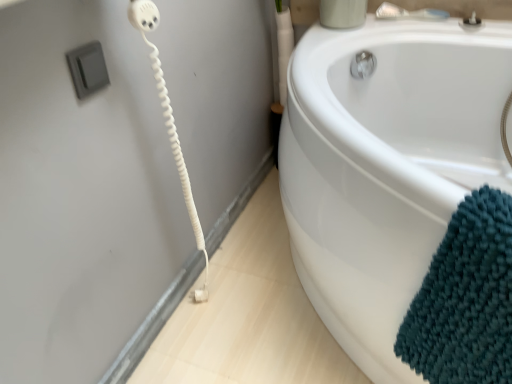
Where is `teal chenille bath towel at lower right`? The height and width of the screenshot is (384, 512). teal chenille bath towel at lower right is located at coordinates (465, 299).

Measure the distance between teal chenille bath towel at lower right and camera.

teal chenille bath towel at lower right and camera are 56.20 centimeters apart from each other.

Describe the element at coordinates (465, 299) in the screenshot. I see `teal chenille bath towel at lower right` at that location.

What do you see at coordinates (409, 13) in the screenshot?
I see `silver metallic faucet at upper right` at bounding box center [409, 13].

Image resolution: width=512 pixels, height=384 pixels. Identify the location of silver metallic faucet at upper right. (409, 13).

Locate an element on the screen. teal chenille bath towel at lower right is located at coordinates (465, 299).

Can you confirm if teal chenille bath towel at lower right is positioned to the left of silver metallic faucet at upper right?

Yes, teal chenille bath towel at lower right is to the left of silver metallic faucet at upper right.

Relative to silver metallic faucet at upper right, is teal chenille bath towel at lower right in front or behind?

In the image, teal chenille bath towel at lower right appears in front of silver metallic faucet at upper right.

Considering the positions of point (434, 361) and point (435, 9), is point (434, 361) closer or farther from the camera than point (435, 9)?

Point (434, 361) appears to be closer to the viewer than point (435, 9).

From the image's perspective, between teal chenille bath towel at lower right and silver metallic faucet at upper right, which one is located above?

From the image's view, silver metallic faucet at upper right is above.

From a real-world perspective, is teal chenille bath towel at lower right positioned under silver metallic faucet at upper right based on gravity?

Yes, from a real-world perspective, teal chenille bath towel at lower right is under silver metallic faucet at upper right.

Does teal chenille bath towel at lower right have a greater width compared to silver metallic faucet at upper right?

Yes.

Between teal chenille bath towel at lower right and silver metallic faucet at upper right, which one has less height?

silver metallic faucet at upper right.

Considering the sizes of teal chenille bath towel at lower right and silver metallic faucet at upper right in the image, is teal chenille bath towel at lower right bigger or smaller than silver metallic faucet at upper right?

In the image, teal chenille bath towel at lower right appears to be larger than silver metallic faucet at upper right.

Is teal chenille bath towel at lower right not inside silver metallic faucet at upper right?

teal chenille bath towel at lower right lies outside silver metallic faucet at upper right's area.

Are teal chenille bath towel at lower right and silver metallic faucet at upper right making contact?

teal chenille bath towel at lower right is not next to silver metallic faucet at upper right, and they're not touching.

Is teal chenille bath towel at lower right facing towards silver metallic faucet at upper right?

No, teal chenille bath towel at lower right is not facing towards silver metallic faucet at upper right.

How many degrees apart are the facing directions of teal chenille bath towel at lower right and silver metallic faucet at upper right?

teal chenille bath towel at lower right and silver metallic faucet at upper right are facing 25.6 degrees away from each other.

Measure the distance between teal chenille bath towel at lower right and silver metallic faucet at upper right.

teal chenille bath towel at lower right is 97.88 centimeters from silver metallic faucet at upper right.

Image resolution: width=512 pixels, height=384 pixels. Identify the location of faucet above the teal chenille bath towel at lower right (from the image's perspective). (409, 13).

Is silver metallic faucet at upper right at the right side of teal chenille bath towel at lower right?

Correct, you'll find silver metallic faucet at upper right to the right of teal chenille bath towel at lower right.

Considering their positions, is silver metallic faucet at upper right located in front of or behind teal chenille bath towel at lower right?

silver metallic faucet at upper right is behind teal chenille bath towel at lower right.

Does point (391, 11) appear closer or farther from the camera than point (412, 319)?

Point (391, 11) appears to be farther away from the viewer than point (412, 319).

From the image's perspective, is silver metallic faucet at upper right above or below teal chenille bath towel at lower right?

Clearly, from the image's perspective, silver metallic faucet at upper right is above teal chenille bath towel at lower right.

From a real-world perspective, is silver metallic faucet at upper right beneath teal chenille bath towel at lower right?

Incorrect, from a real-world perspective, silver metallic faucet at upper right is higher than teal chenille bath towel at lower right.

Is silver metallic faucet at upper right wider or thinner than teal chenille bath towel at lower right?

silver metallic faucet at upper right is thinner than teal chenille bath towel at lower right.

In terms of height, does silver metallic faucet at upper right look taller or shorter compared to teal chenille bath towel at lower right?

silver metallic faucet at upper right is shorter than teal chenille bath towel at lower right.

In terms of size, does silver metallic faucet at upper right appear bigger or smaller than teal chenille bath towel at lower right?

silver metallic faucet at upper right is smaller than teal chenille bath towel at lower right.

Would you say silver metallic faucet at upper right is outside teal chenille bath towel at lower right?

Yes.

Is silver metallic faucet at upper right next to teal chenille bath towel at lower right?

They are not placed beside each other.

Is silver metallic faucet at upper right oriented away from teal chenille bath towel at lower right?

No, silver metallic faucet at upper right is not facing the opposite direction of teal chenille bath towel at lower right.

Find the location of a particular element. faucet above the teal chenille bath towel at lower right (from the image's perspective) is located at coordinates (409, 13).

In the image, there is a teal chenille bath towel at lower right. Where is `faucet above it (from the image's perspective)`? faucet above it (from the image's perspective) is located at coordinates (409, 13).

Where is `bath towel directly beneath the silver metallic faucet at upper right (from a real-world perspective)`? bath towel directly beneath the silver metallic faucet at upper right (from a real-world perspective) is located at coordinates (465, 299).